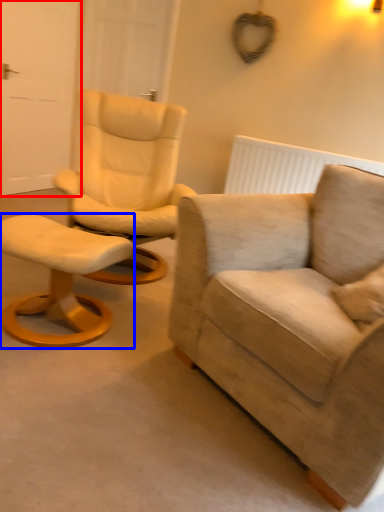
Question: Among these objects, which one is nearest to the camera, door (highlighted by a red box) or stool (highlighted by a blue box)?

Choices:
 (A) door
 (B) stool

Answer: (B)